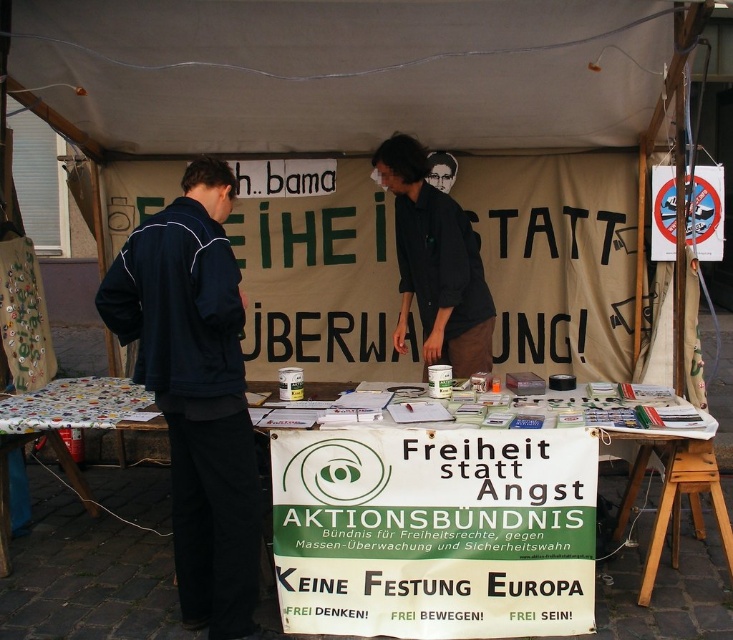
Can you confirm if white fabric canopy at upper center is wider than white paper table at center?

Correct, the width of white fabric canopy at upper center exceeds that of white paper table at center.

Between white fabric canopy at upper center and white paper table at center, which one appears on the right side from the viewer's perspective?

From the viewer's perspective, white paper table at center appears more on the right side.

Which is behind, point (22, 74) or point (421, 516)?

Positioned behind is point (22, 74).

Find the location of a particular element. The width and height of the screenshot is (733, 640). white fabric canopy at upper center is located at coordinates (342, 72).

Can you confirm if white paper table at center is positioned to the right of black matte shirt at center?

Correct, you'll find white paper table at center to the right of black matte shirt at center.

Between point (586, 497) and point (452, 248), which one is positioned behind?

The point (452, 248) is behind.

This screenshot has height=640, width=733. Find the location of `white paper table at center`. white paper table at center is located at coordinates (471, 540).

Is white fabric canopy at upper center to the right of black matte shirt at center from the viewer's perspective?

Incorrect, white fabric canopy at upper center is not on the right side of black matte shirt at center.

Can you confirm if white fabric canopy at upper center is smaller than black matte shirt at center?

No.

Where is `white fabric canopy at upper center`? white fabric canopy at upper center is located at coordinates (342, 72).